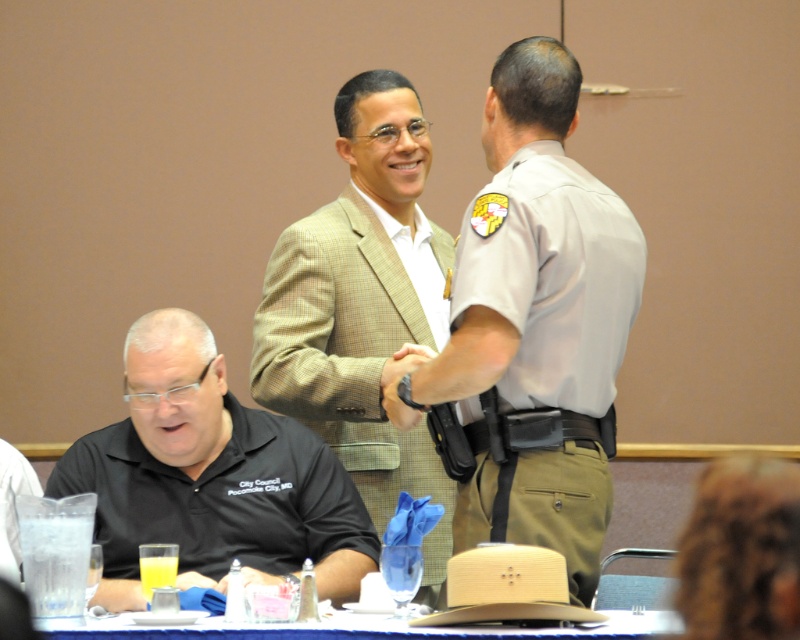
Question: Does light brown textured blazer at center come in front of black matte shirt at lower left?

Choices:
 (A) no
 (B) yes

Answer: (A)

Question: Among these objects, which one is farthest from the camera?

Choices:
 (A) khaki textured suit at upper center
 (B) blue fabric table at lower center
 (C) light brown textured blazer at center
 (D) black matte shirt at lower left

Answer: (C)

Question: Which of the following is the farthest from the observer?

Choices:
 (A) khaki textured suit at upper center
 (B) light brown textured blazer at center
 (C) black matte shirt at lower left
 (D) blue fabric table at lower center

Answer: (B)

Question: Which of the following is the closest to the observer?

Choices:
 (A) khaki textured suit at upper center
 (B) blue fabric table at lower center
 (C) light brown textured blazer at center

Answer: (B)

Question: Does khaki textured suit at upper center have a smaller size compared to light brown textured blazer at center?

Choices:
 (A) yes
 (B) no

Answer: (B)

Question: Can you confirm if light brown textured blazer at center is thinner than black matte shirt at lower left?

Choices:
 (A) yes
 (B) no

Answer: (A)